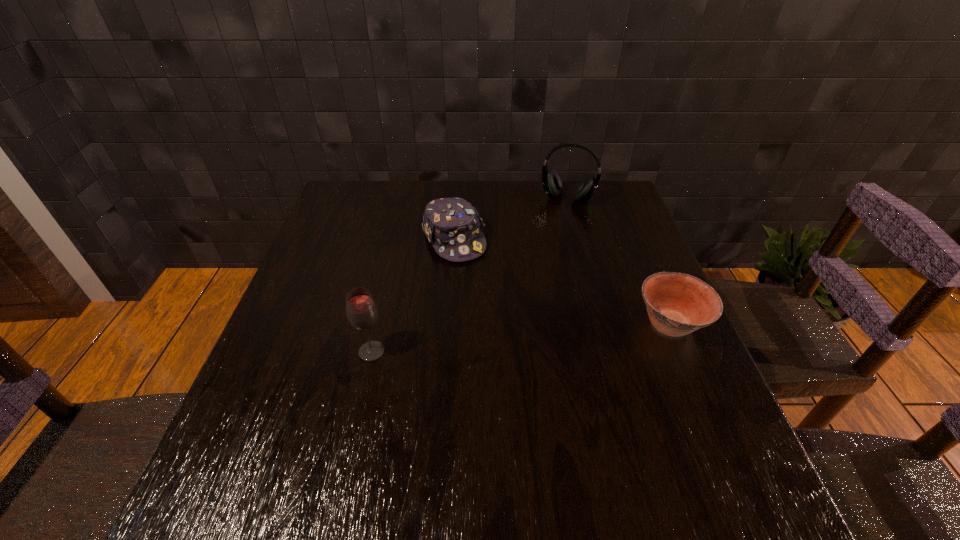
Image resolution: width=960 pixels, height=540 pixels. Find the location of `free space between the farthest object and the second object from left to right`. free space between the farthest object and the second object from left to right is located at coordinates (511, 219).

Find the location of a particular element. The height and width of the screenshot is (540, 960). vacant point located between the glass drink container and the bowl is located at coordinates (521, 338).

In order to click on unoccupied position between the headwear and the glass drink container in this screenshot , I will do (413, 296).

I want to click on free spot between the bowl and the glass drink container, so click(x=521, y=338).

Locate an element on the screen. object identified as the second closest to the bowl is located at coordinates (551, 181).

The width and height of the screenshot is (960, 540). Find the location of `the third closest object to the headset`. the third closest object to the headset is located at coordinates (361, 311).

You are a GUI agent. You are given a task and a screenshot of the screen. Output one action in this format:
    pyautogui.click(x=<x>, y=<y>)
    Task: Click on the vacant area in the image that satisfies the following two spatial constraints: 1. on the front side of the bowl; 2. on the left side of the headset
    The width and height of the screenshot is (960, 540).
    Given the screenshot: What is the action you would take?
    pyautogui.click(x=602, y=324)

This screenshot has width=960, height=540. I want to click on free space that satisfies the following two spatial constraints: 1. on the back side of the headwear; 2. on the right side of the headset, so click(x=457, y=199).